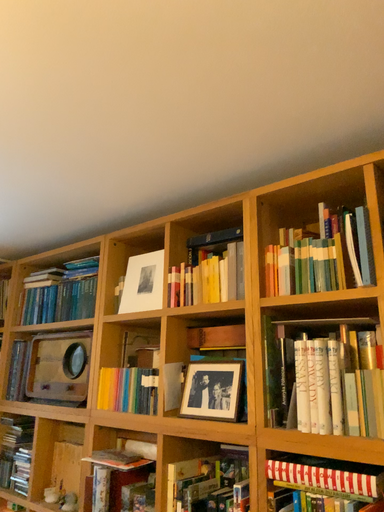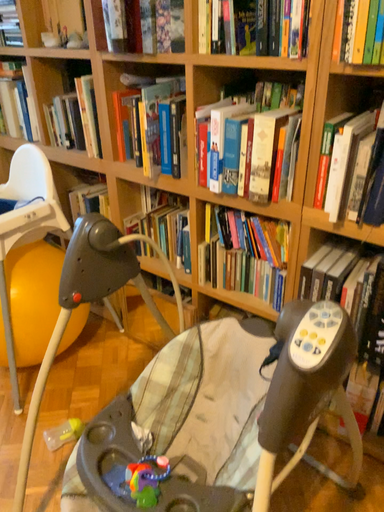
Question: How did the camera likely rotate when shooting the video?

Choices:
 (A) rotated downward
 (B) rotated upward

Answer: (A)